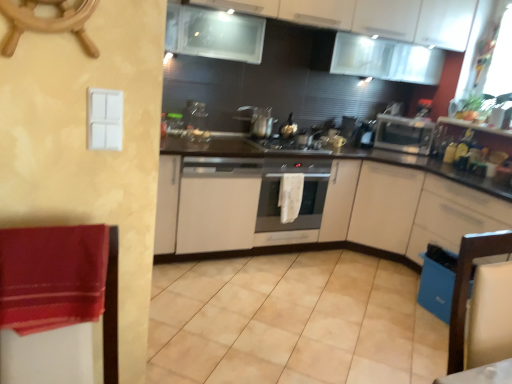
Where is `free space to the left of blue plastic dishwasher at lower right`? This screenshot has height=384, width=512. free space to the left of blue plastic dishwasher at lower right is located at coordinates (391, 306).